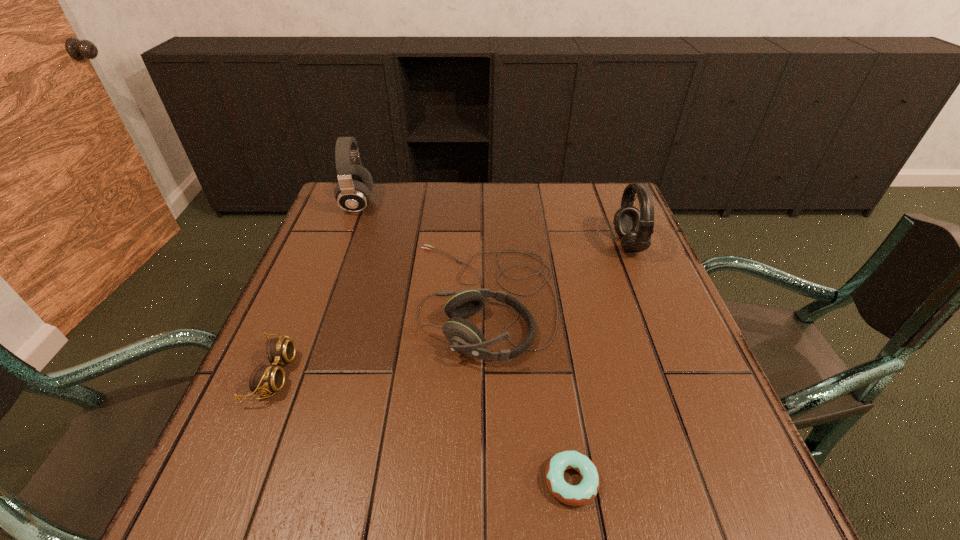
Where is `the tallest headset`? The width and height of the screenshot is (960, 540). the tallest headset is located at coordinates (353, 192).

What are the coordinates of `the farthest object` in the screenshot? It's located at (353, 192).

The image size is (960, 540). I want to click on the fourth shortest object, so click(x=635, y=227).

Find the location of a particular element. This screenshot has width=960, height=540. the rightmost object is located at coordinates (635, 227).

Where is `the third shortest object`? the third shortest object is located at coordinates (464, 336).

Locate an element on the screen. The width and height of the screenshot is (960, 540). the second headset from left to right is located at coordinates (464, 336).

Where is `goggles`? goggles is located at coordinates (265, 379).

This screenshot has width=960, height=540. Find the location of `the shortest object`. the shortest object is located at coordinates (574, 495).

Identify the location of the nearest object. The height and width of the screenshot is (540, 960). (574, 495).

Image resolution: width=960 pixels, height=540 pixels. Find the location of `vacant space located 0.330m on the ear cups of the tallest object`. vacant space located 0.330m on the ear cups of the tallest object is located at coordinates (487, 204).